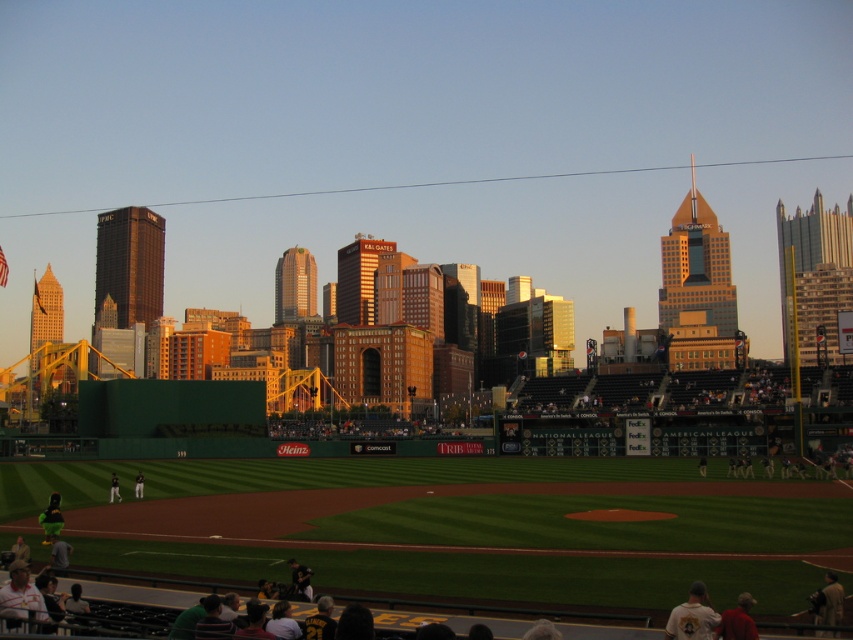
Does white jersey at lower right appear over dark blue shirt at lower center?

Yes.

Identify the location of white jersey at lower right. This screenshot has width=853, height=640. (692, 616).

You are a GUI agent. You are given a task and a screenshot of the screen. Output one action in this format:
    pyautogui.click(x=<x>, y=<y>)
    Task: Click on the white jersey at lower right
    The image size is (853, 640).
    Given the screenshot: What is the action you would take?
    pyautogui.click(x=692, y=616)

Is the position of dark blue shirt at lower center less distant than that of dark blue uniform at center?

Yes.

Is dark blue shirt at lower center positioned at the back of dark blue uniform at center?

No, it is in front of dark blue uniform at center.

Is point (294, 577) farther from viewer compared to point (143, 483)?

No.

The image size is (853, 640). In order to click on dark blue shirt at lower center in this screenshot , I will do `click(299, 580)`.

Is red fabric shirt at lower right bigger than dark blue uniform at center?

No.

Consider the image. How far apart are red fabric shirt at lower right and dark blue uniform at center?

They are 53.28 meters apart.

Based on the photo, who is more forward, (x=747, y=621) or (x=138, y=480)?

Point (x=747, y=621)

Locate an element on the screen. The height and width of the screenshot is (640, 853). red fabric shirt at lower right is located at coordinates (737, 620).